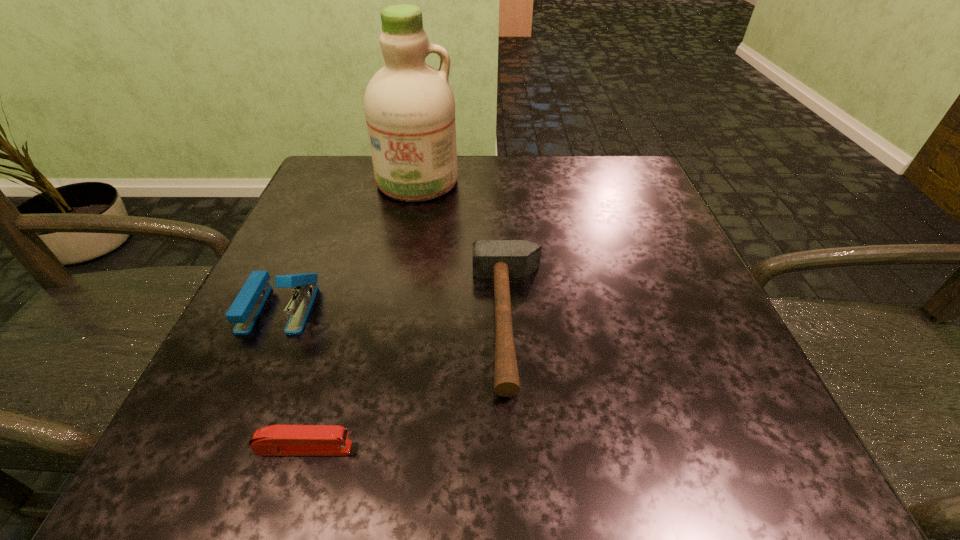
This screenshot has width=960, height=540. What are the coordinates of `the tallest object` in the screenshot? It's located at (409, 106).

You are a GUI agent. You are given a task and a screenshot of the screen. Output one action in this format:
    pyautogui.click(x=<x>, y=<y>)
    Task: Click on the cleansing agent
    The image size is (960, 540).
    Given the screenshot: What is the action you would take?
    pyautogui.click(x=409, y=106)

Where is `the taller stapler`? The width and height of the screenshot is (960, 540). the taller stapler is located at coordinates (244, 311).

Identify the location of the farther stapler. Image resolution: width=960 pixels, height=540 pixels. [x=244, y=311].

What are the coordinates of `the rightmost object` in the screenshot? It's located at pos(501,260).

Locate an element on the screen. This screenshot has height=540, width=960. hammer is located at coordinates (501, 260).

Where is `the shortest object`? This screenshot has width=960, height=540. the shortest object is located at coordinates (277, 440).

Locate an element on the screen. the nearer stapler is located at coordinates (277, 440).

In order to click on vacant area situated on the front label of the cleansing agent in this screenshot , I will do `click(388, 330)`.

This screenshot has width=960, height=540. I want to click on vacant area situated on the right of the taller stapler, so click(378, 308).